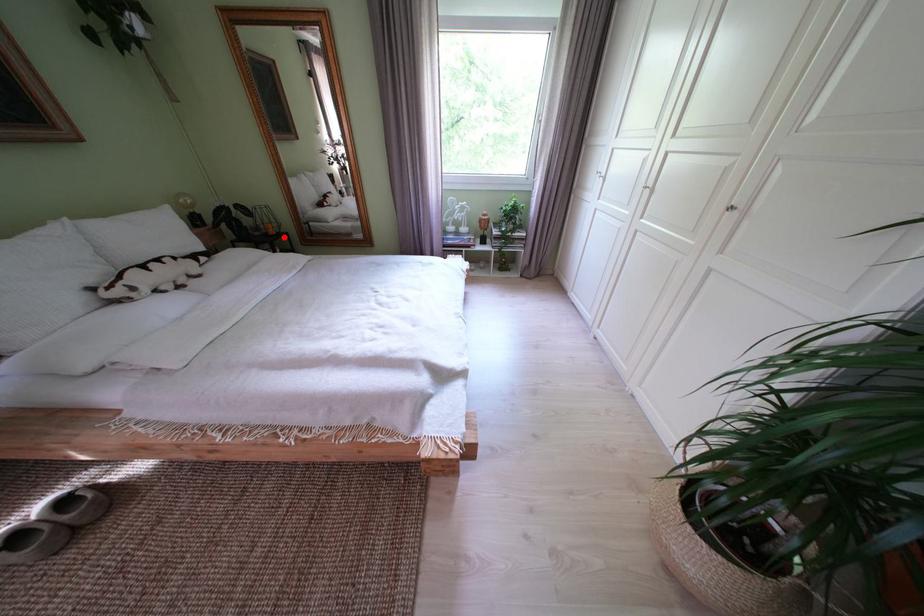
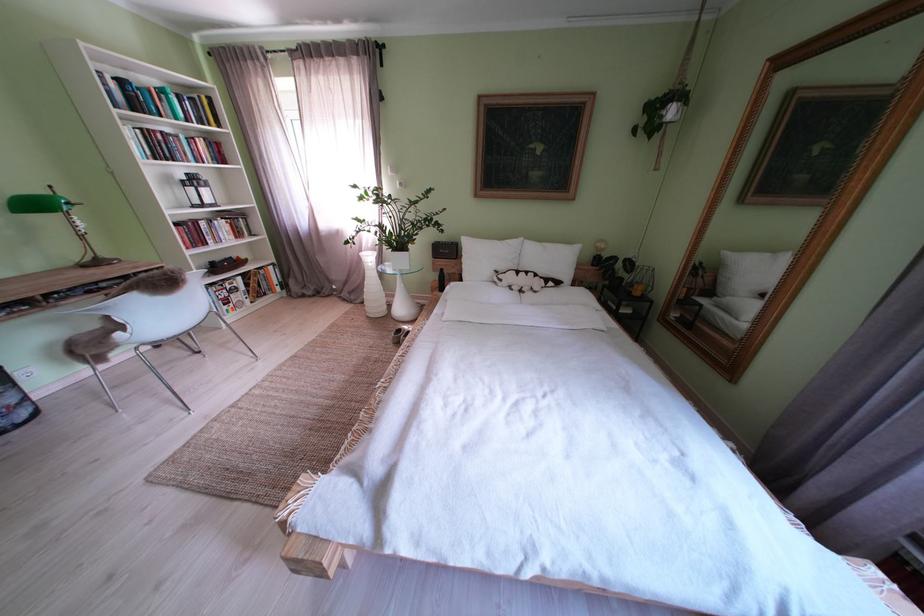
Where in the second image is the point corresponding to the highlighted location from the first image?

(648, 299)